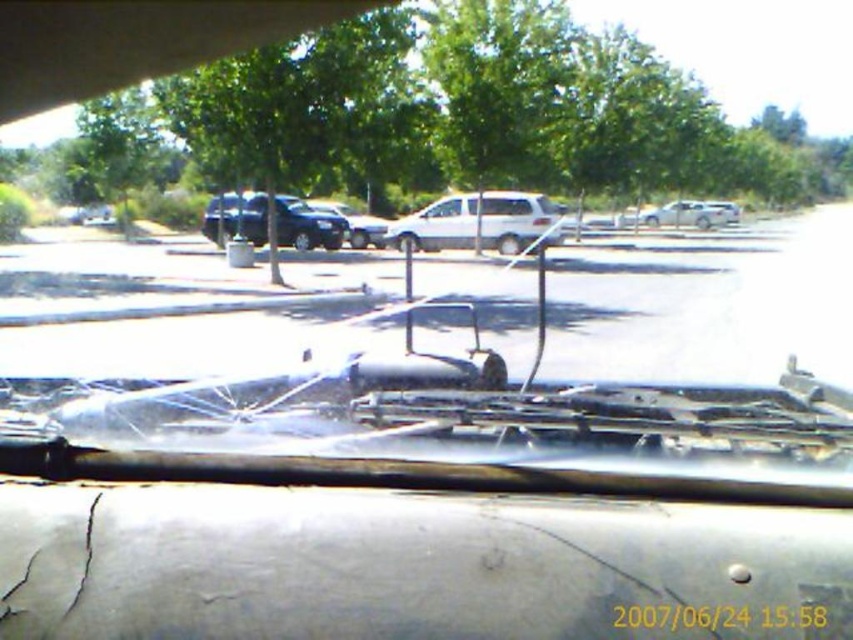
You are a parking attendant and need to fit both the white matte car at center and the satin black suv at center into a parking space that is exactly the width of the wider vehicle. Which vehicle should be parked first to ensure both fit?

The white matte car at center is wider than the satin black suv at center. Therefore, park the white matte car at center first to ensure it fits within the space, then the satin black suv at center can be positioned alongside or behind without width issues.

You are sitting in the driver seat of the vehicle and notice two points on the windshield. The first point is at coordinates point (448,218) and the second is at point (711,227). Which point is closer to your eyes?

Point (448,218) is closer to the viewer than point (711,227).